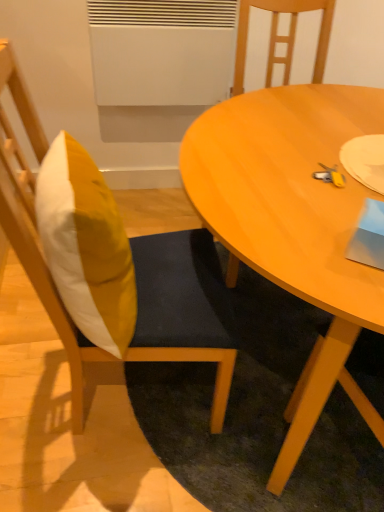
Question: Does wooden chair at center, the second chair positioned from the left, appear on the left side of light brown wooden table at center?

Choices:
 (A) yes
 (B) no

Answer: (A)

Question: Is wooden chair at center, the second chair positioned from the left, bigger than light brown wooden table at center?

Choices:
 (A) yes
 (B) no

Answer: (B)

Question: Is wooden chair at center, which is the 1th chair in right-to-left order, wider than light brown wooden table at center?

Choices:
 (A) no
 (B) yes

Answer: (A)

Question: Could you tell me if wooden chair at center, which is the 1th chair in right-to-left order, is facing light brown wooden table at center?

Choices:
 (A) no
 (B) yes

Answer: (B)

Question: Is wooden chair at center, which is the 1th chair in right-to-left order, located outside light brown wooden table at center?

Choices:
 (A) no
 (B) yes

Answer: (A)

Question: Is wooden chair at center, which is the 1th chair in right-to-left order, thinner than light brown wooden table at center?

Choices:
 (A) yes
 (B) no

Answer: (A)

Question: Is light brown wooden table at center smaller than wooden chair at left, which appears as the first chair when viewed from the left?

Choices:
 (A) no
 (B) yes

Answer: (A)

Question: Can you confirm if light brown wooden table at center is taller than wooden chair at left, which appears as the first chair when viewed from the left?

Choices:
 (A) no
 (B) yes

Answer: (A)

Question: Does light brown wooden table at center have a greater width compared to wooden chair at left, which appears as the first chair when viewed from the left?

Choices:
 (A) yes
 (B) no

Answer: (A)

Question: Does light brown wooden table at center lie behind wooden chair at left, which appears as the first chair when viewed from the left?

Choices:
 (A) yes
 (B) no

Answer: (B)

Question: From a real-world perspective, is light brown wooden table at center under wooden chair at left, which appears as the first chair when viewed from the left?

Choices:
 (A) no
 (B) yes

Answer: (B)

Question: Is light brown wooden table at center closer to camera compared to wooden chair at left, which appears as the first chair when viewed from the left?

Choices:
 (A) no
 (B) yes

Answer: (B)

Question: From the image's perspective, does yellow fabric pillow at left appear higher than wooden chair at center, the second chair positioned from the left?

Choices:
 (A) no
 (B) yes

Answer: (A)